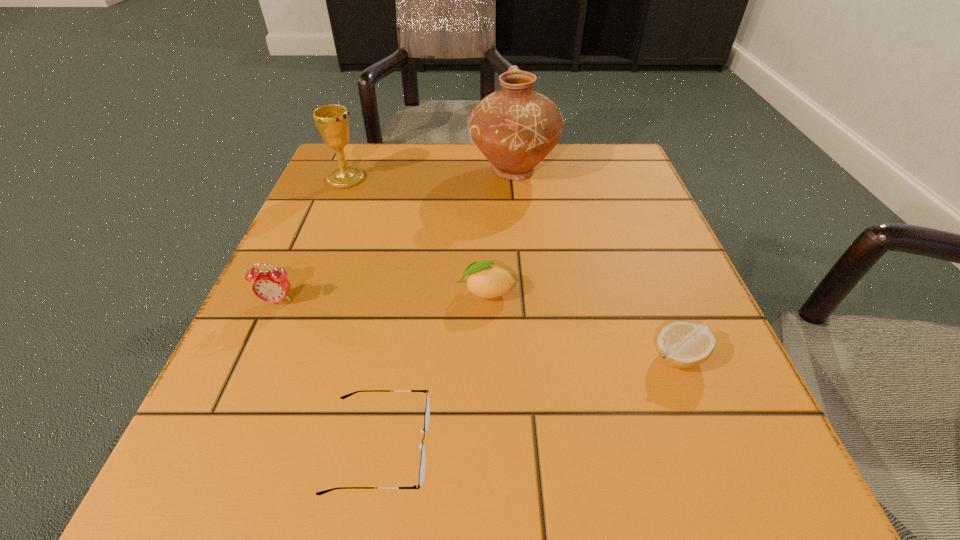
This screenshot has height=540, width=960. What are the coordinates of `blank space located 0.160m on the face of the third tallest object` in the screenshot? It's located at (235, 397).

Where is `vacant area situated with leaves positioned above the left lemon`? This screenshot has width=960, height=540. vacant area situated with leaves positioned above the left lemon is located at coordinates (337, 292).

Find the location of `vacant region located with leaves positioned above the left lemon`. vacant region located with leaves positioned above the left lemon is located at coordinates (355, 292).

The width and height of the screenshot is (960, 540). I want to click on free space located 0.290m with leaves positioned above the left lemon, so click(x=282, y=292).

This screenshot has height=540, width=960. In order to click on vacant space situated on the left of the rightmost object in this screenshot , I will do `click(391, 356)`.

This screenshot has height=540, width=960. I want to click on free location located on the lenses of the spectacles, so click(724, 447).

Image resolution: width=960 pixels, height=540 pixels. In order to click on pottery located at the far edge in this screenshot , I will do `click(515, 128)`.

Where is `chalice at the far edge`? The width and height of the screenshot is (960, 540). chalice at the far edge is located at coordinates (332, 121).

I want to click on object that is at the near edge, so click(427, 409).

This screenshot has height=540, width=960. Find the location of `chalice that is at the left edge`. chalice that is at the left edge is located at coordinates (332, 121).